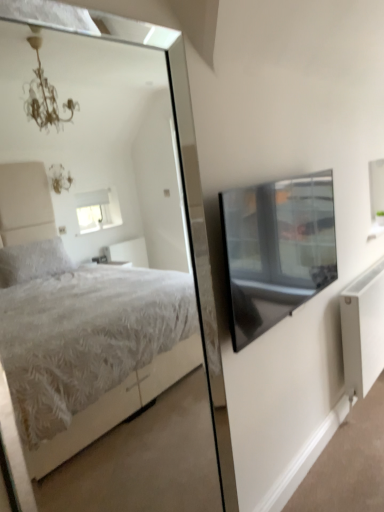
Question: From the image's perspective, does white matte radiator at lower right appear higher than white textured bed at center?

Choices:
 (A) no
 (B) yes

Answer: (A)

Question: Is white matte radiator at lower right turned away from white textured bed at center?

Choices:
 (A) yes
 (B) no

Answer: (B)

Question: Can you confirm if white matte radiator at lower right is smaller than white textured bed at center?

Choices:
 (A) no
 (B) yes

Answer: (A)

Question: Can you confirm if white matte radiator at lower right is bigger than white textured bed at center?

Choices:
 (A) no
 (B) yes

Answer: (B)

Question: From the image's perspective, is white matte radiator at lower right located beneath white textured bed at center?

Choices:
 (A) yes
 (B) no

Answer: (A)

Question: In terms of width, does transparent glass window screen at upper right look wider or thinner when compared to white matte radiator at lower right?

Choices:
 (A) thin
 (B) wide

Answer: (A)

Question: From a real-world perspective, relative to white matte radiator at lower right, is transparent glass window screen at upper right vertically above or below?

Choices:
 (A) above
 (B) below

Answer: (A)

Question: Do you think transparent glass window screen at upper right is within white matte radiator at lower right, or outside of it?

Choices:
 (A) outside
 (B) inside

Answer: (A)

Question: Is transparent glass window screen at upper right bigger or smaller than white matte radiator at lower right?

Choices:
 (A) small
 (B) big

Answer: (A)

Question: From their relative heights in the image, would you say white matte radiator at lower right is taller or shorter than transparent glass window screen at upper right?

Choices:
 (A) short
 (B) tall

Answer: (B)

Question: From the image's perspective, is white matte radiator at lower right above or below transparent glass window screen at upper right?

Choices:
 (A) above
 (B) below

Answer: (B)

Question: Looking at their shapes, would you say white matte radiator at lower right is wider or thinner than transparent glass window screen at upper right?

Choices:
 (A) wide
 (B) thin

Answer: (A)

Question: Is white matte radiator at lower right spatially inside transparent glass window screen at upper right, or outside of it?

Choices:
 (A) inside
 (B) outside

Answer: (B)

Question: Considering the positions of point (221, 231) and point (44, 205), is point (221, 231) closer or farther from the camera than point (44, 205)?

Choices:
 (A) closer
 (B) farther

Answer: (A)

Question: Considering their positions, is transparent glass window screen at upper right located in front of or behind white textured bed at center?

Choices:
 (A) front
 (B) behind

Answer: (B)